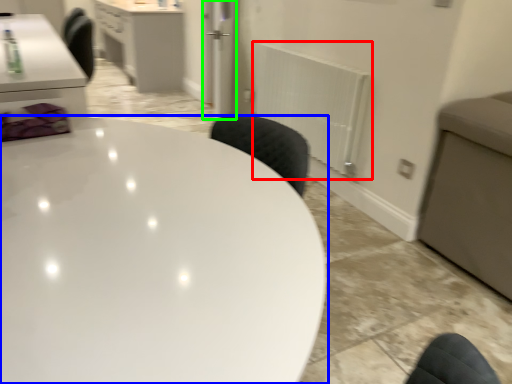
Question: Which is farther away from radiator (highlighted by a red box)? table (highlighted by a blue box) or glass door (highlighted by a green box)?

Choices:
 (A) table
 (B) glass door

Answer: (A)